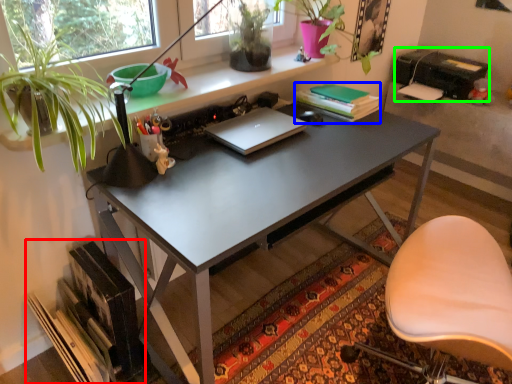
Question: Based on their relative distances, which object is nearer to book (highlighted by a red box)? Choose from book (highlighted by a blue box) and printer (highlighted by a green box).

Choices:
 (A) book
 (B) printer

Answer: (A)